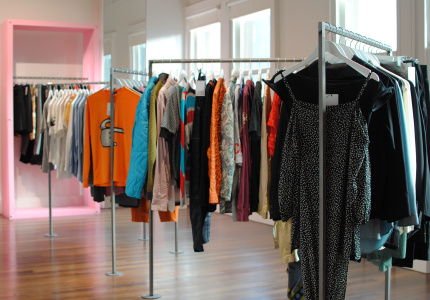
At what (x,y) coordinates should I click in order to perform the action: click on white walls. Please return your answer as a coordinate pair (x, y). Image resolution: width=430 pixels, height=300 pixels. Looking at the image, I should click on (303, 27), (171, 16), (77, 10).